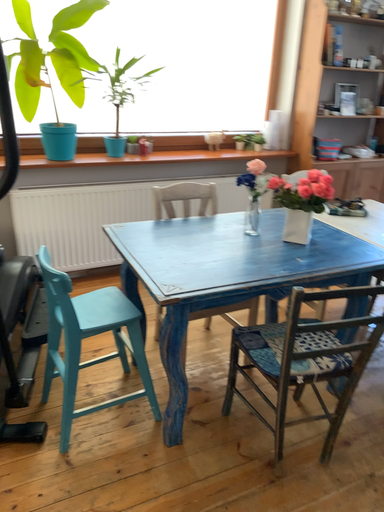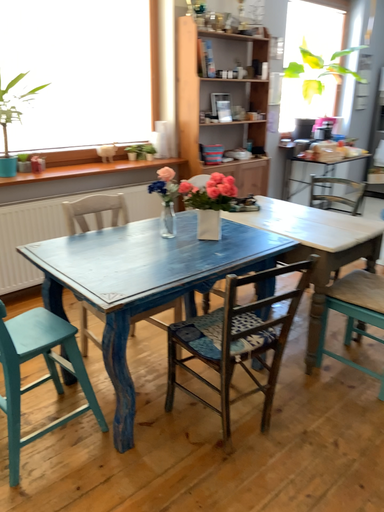
Question: Which way did the camera rotate in the video?

Choices:
 (A) rotated right
 (B) rotated left

Answer: (A)